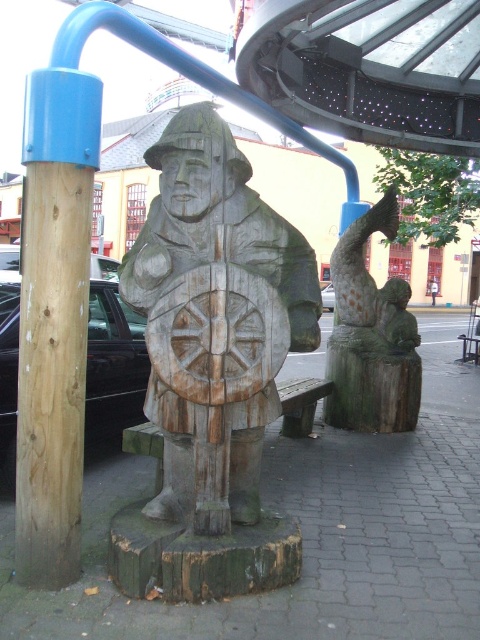
Is the position of natural wood post at left less distant than that of wooden statue at right?

Yes.

Identify the location of natural wood post at left. This screenshot has height=640, width=480. click(x=54, y=321).

Which is behind, point (191, 429) or point (54, 445)?

Point (191, 429)

Does wooden shield at center appear on the right side of natural wood post at left?

Indeed, wooden shield at center is positioned on the right side of natural wood post at left.

Where is `wooden shield at center`? wooden shield at center is located at coordinates (215, 308).

Find the location of a particular element. This screenshot has height=640, width=480. wooden shield at center is located at coordinates (215, 308).

Does point (251, 202) come closer to viewer compared to point (362, 376)?

Yes, it is in front of point (362, 376).

Is wooden shield at center further to the viewer compared to wooden statue at right?

That is False.

Describe the element at coordinates (215, 308) in the screenshot. I see `wooden shield at center` at that location.

I want to click on wooden shield at center, so click(215, 308).